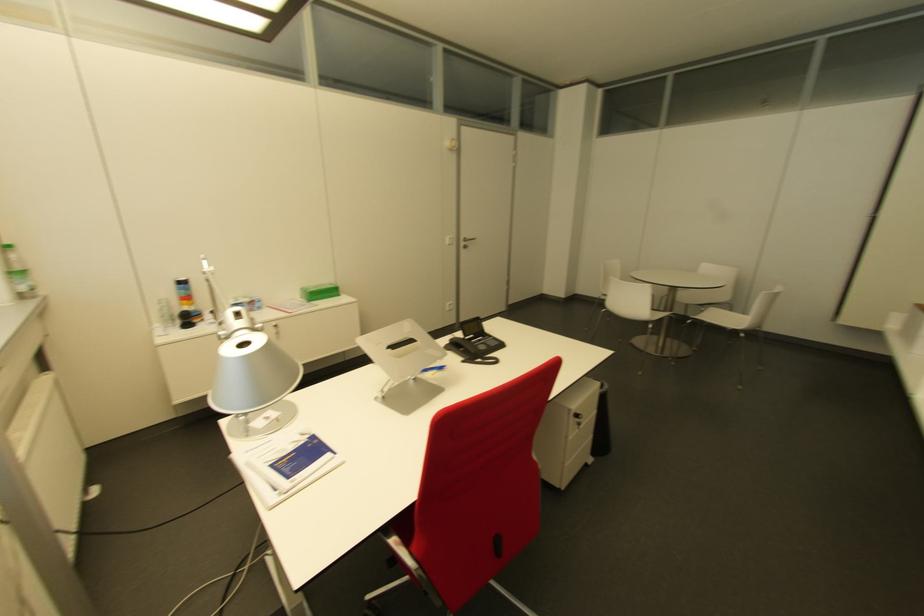
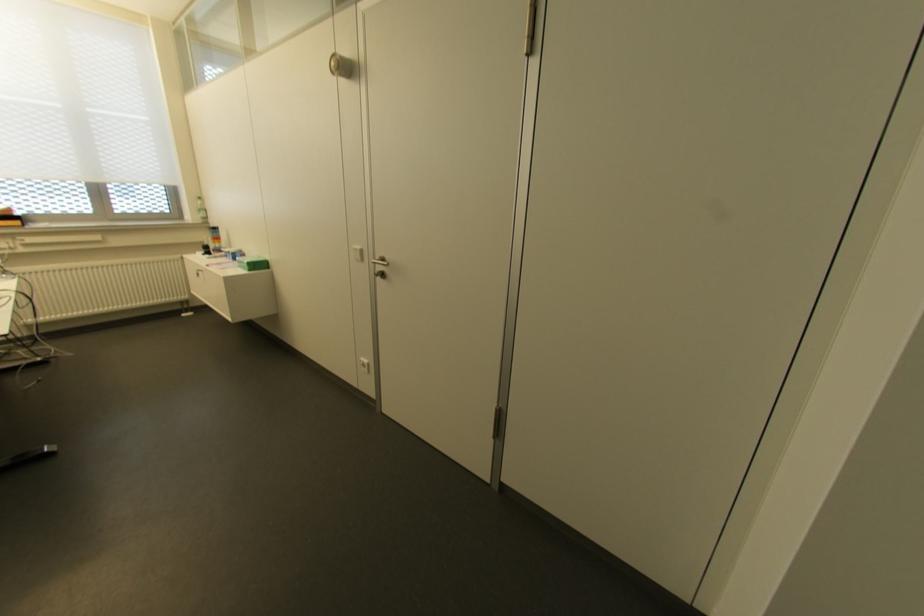
Locate, in the second image, the point that corresponds to (x=188, y=304) in the first image.

(213, 243)